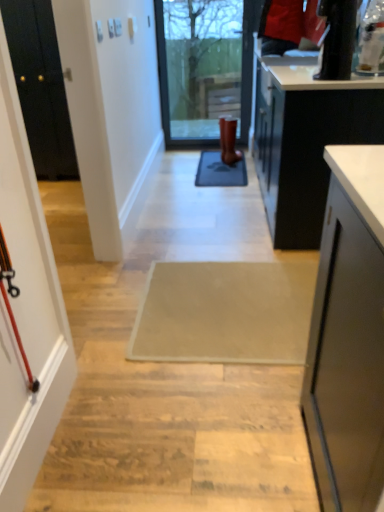
Question: In the image, is matte black screen door at left positioned in front of or behind white glossy countertop at upper right?

Choices:
 (A) front
 (B) behind

Answer: (A)

Question: Is matte black screen door at left bigger or smaller than white glossy countertop at upper right?

Choices:
 (A) small
 (B) big

Answer: (A)

Question: Which is farther from the white glossy countertop at upper right?

Choices:
 (A) beige fabric doormat at center, which is the second doormat from back to front
 (B) matte black screen door at left
 (C) gray rubber doormat at center, placed as the first doormat when sorted from top to bottom
 (D) brown leather boot at center
 (E) transparent glass door at center

Answer: (E)

Question: Based on their relative distances, which object is farther from the brown leather boot at center?

Choices:
 (A) gray rubber doormat at center, positioned as the second doormat in front-to-back order
 (B) beige fabric doormat at center, which is the 1th doormat from bottom to top
 (C) transparent glass door at center
 (D) matte black screen door at left
 (E) white glossy countertop at upper right

Answer: (D)